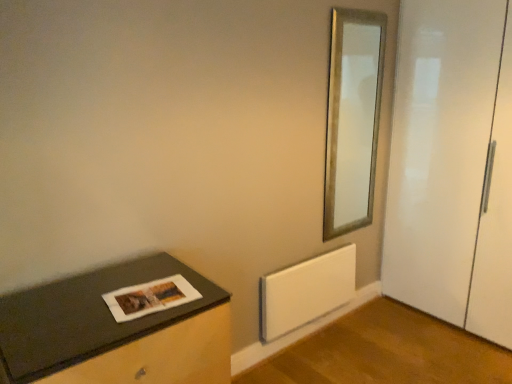
Question: Can you confirm if white matte radiator at lower center is thinner than dark gray matte table at lower left?

Choices:
 (A) no
 (B) yes

Answer: (B)

Question: From the image's perspective, is white matte radiator at lower center on dark gray matte table at lower left?

Choices:
 (A) yes
 (B) no

Answer: (A)

Question: Does white matte radiator at lower center come in front of dark gray matte table at lower left?

Choices:
 (A) no
 (B) yes

Answer: (A)

Question: Can you confirm if white matte radiator at lower center is smaller than dark gray matte table at lower left?

Choices:
 (A) yes
 (B) no

Answer: (A)

Question: From a real-world perspective, does white matte radiator at lower center sit lower than dark gray matte table at lower left?

Choices:
 (A) yes
 (B) no

Answer: (A)

Question: From the image's perspective, is white matte radiator at lower center above or below white glossy door at right?

Choices:
 (A) below
 (B) above

Answer: (A)

Question: Based on their positions, is white matte radiator at lower center located to the left or right of white glossy door at right?

Choices:
 (A) right
 (B) left

Answer: (B)

Question: From their relative heights in the image, would you say white matte radiator at lower center is taller or shorter than white glossy door at right?

Choices:
 (A) tall
 (B) short

Answer: (B)

Question: Considering the positions of white matte radiator at lower center and white glossy door at right in the image, is white matte radiator at lower center bigger or smaller than white glossy door at right?

Choices:
 (A) small
 (B) big

Answer: (A)

Question: From the image's perspective, is dark gray matte table at lower left located above or below white matte radiator at lower center?

Choices:
 (A) above
 (B) below

Answer: (B)

Question: Relative to white matte radiator at lower center, is dark gray matte table at lower left in front or behind?

Choices:
 (A) front
 (B) behind

Answer: (A)

Question: From a real-world perspective, is dark gray matte table at lower left physically located above or below white matte radiator at lower center?

Choices:
 (A) above
 (B) below

Answer: (A)

Question: Is dark gray matte table at lower left to the left or to the right of white matte radiator at lower center in the image?

Choices:
 (A) left
 (B) right

Answer: (A)

Question: From the image's perspective, is dark gray matte table at lower left positioned above or below gold metallic mirror at upper right?

Choices:
 (A) below
 (B) above

Answer: (A)

Question: Is dark gray matte table at lower left in front of or behind gold metallic mirror at upper right in the image?

Choices:
 (A) front
 (B) behind

Answer: (A)